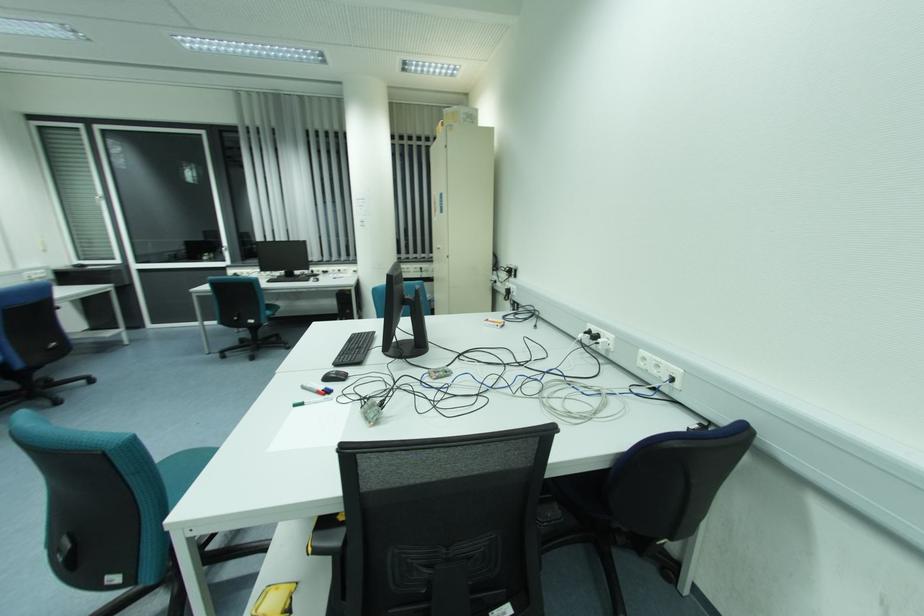
Where would you lift the black keyboard? Please return your answer as a coordinate pair (x, y).

(354, 349)